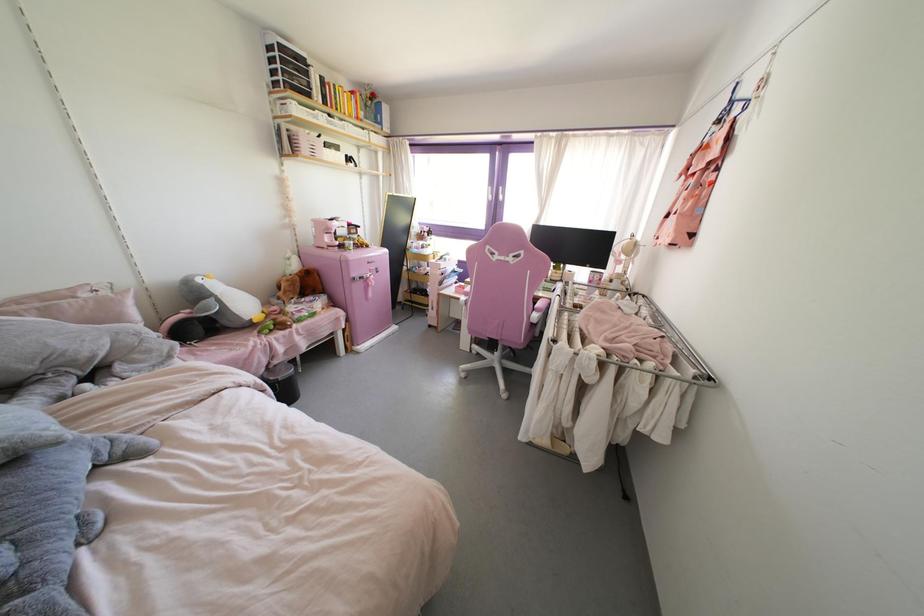
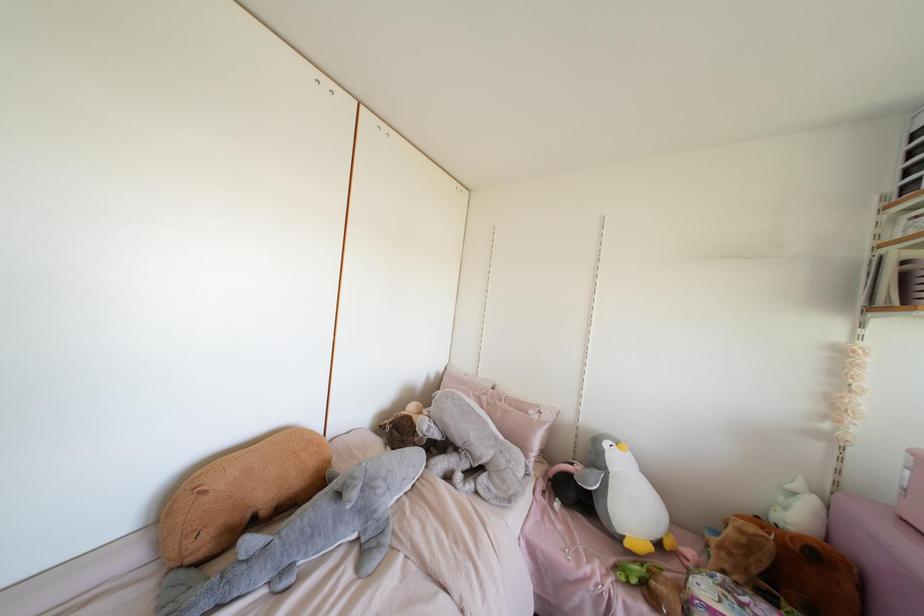
Find the pixel in the second image that matches pixel 83 294 in the first image.

(530, 411)